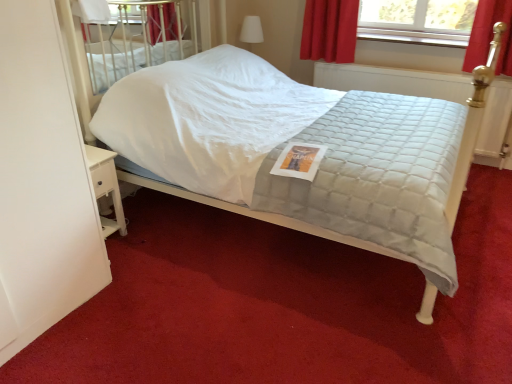
Find the location of a particular element. white matte screen door at left is located at coordinates (42, 182).

In order to click on white matte screen door at left in this screenshot , I will do `click(42, 182)`.

From the image's perspective, relative to white quilted fabric bed at center, is white wood nightstand at lower left above or below?

white wood nightstand at lower left is situated lower than white quilted fabric bed at center in the image.

Is white wood nightstand at lower left facing away from white quilted fabric bed at center?

white wood nightstand at lower left does not have its back to white quilted fabric bed at center.

Considering the relative positions of white wood nightstand at lower left and white quilted fabric bed at center in the image provided, is white wood nightstand at lower left to the left of white quilted fabric bed at center from the viewer's perspective?

Indeed, white wood nightstand at lower left is positioned on the left side of white quilted fabric bed at center.

Between white wood nightstand at lower left and white matte screen door at left, which one appears on the left side from the viewer's perspective?

From the viewer's perspective, white matte screen door at left appears more on the left side.

Considering the relative sizes of white wood nightstand at lower left and white matte screen door at left in the image provided, is white wood nightstand at lower left bigger than white matte screen door at left?

Incorrect, white wood nightstand at lower left is not larger than white matte screen door at left.

Does white wood nightstand at lower left have a greater width compared to white matte screen door at left?

No, white wood nightstand at lower left is not wider than white matte screen door at left.

Which is in front, white wood nightstand at lower left or white matte screen door at left?

white matte screen door at left is in front.

Does white matte screen door at left appear on the left side of white wood nightstand at lower left?

Yes, white matte screen door at left is to the left of white wood nightstand at lower left.

Is white matte screen door at left not within white wood nightstand at lower left?

Yes, white matte screen door at left is located beyond the bounds of white wood nightstand at lower left.

Is white matte screen door at left turned away from white wood nightstand at lower left?

No, white wood nightstand at lower left is not at the back of white matte screen door at left.

Considering the points (57, 240) and (104, 187), which point is in front, point (57, 240) or point (104, 187)?

Point (57, 240)

Who is shorter, white quilted fabric bed at center or white wood nightstand at lower left?

white wood nightstand at lower left.

Is white quilted fabric bed at center turned away from white wood nightstand at lower left?

That's not correct — white quilted fabric bed at center is not looking away from white wood nightstand at lower left.

Is white quilted fabric bed at center situated inside white wood nightstand at lower left or outside?

white quilted fabric bed at center is located beyond the bounds of white wood nightstand at lower left.

Which is more to the right, white quilted fabric bed at center or white wood nightstand at lower left?

white quilted fabric bed at center is more to the right.

Between white quilted fabric bed at center and white matte screen door at left, which one has larger size?

white quilted fabric bed at center is bigger.

Measure the distance between white quilted fabric bed at center and white matte screen door at left.

white quilted fabric bed at center is 3.40 feet away from white matte screen door at left.

Would you say white quilted fabric bed at center is outside white matte screen door at left?

Yes, white quilted fabric bed at center is not within white matte screen door at left.

Who is taller, white quilted fabric bed at center or white matte screen door at left?

Standing taller between the two is white matte screen door at left.

Considering the relative sizes of white matte screen door at left and white quilted fabric bed at center in the image provided, is white matte screen door at left bigger than white quilted fabric bed at center?

Incorrect, white matte screen door at left is not larger than white quilted fabric bed at center.

Could you tell me if white matte screen door at left is turned towards white quilted fabric bed at center?

No, white matte screen door at left does not turn towards white quilted fabric bed at center.

Is white matte screen door at left touching white quilted fabric bed at center?

white matte screen door at left is not next to white quilted fabric bed at center, and they're not touching.

Consider the image. Does white matte screen door at left have a lesser height compared to white quilted fabric bed at center?

No.

This screenshot has height=384, width=512. In order to click on bed located on the right of white wood nightstand at lower left in this screenshot , I will do [280, 143].

Where is `nightstand below the white matte screen door at left (from the image's perspective)`? This screenshot has height=384, width=512. nightstand below the white matte screen door at left (from the image's perspective) is located at coordinates (106, 187).

Considering their positions, is white wood nightstand at lower left positioned further to white matte screen door at left than white quilted fabric bed at center?

Based on the image, white quilted fabric bed at center appears to be further to white matte screen door at left.

When comparing their distances from white wood nightstand at lower left, does white matte screen door at left or white quilted fabric bed at center seem closer?

white matte screen door at left.

Looking at the image, which one is located further to white matte screen door at left, white quilted fabric bed at center or white wood nightstand at lower left?

white quilted fabric bed at center is further to white matte screen door at left.

When comparing their distances from white wood nightstand at lower left, does white quilted fabric bed at center or white matte screen door at left seem closer?

The object closer to white wood nightstand at lower left is white matte screen door at left.

Estimate the real-world distances between objects in this image. Which object is further from white quilted fabric bed at center, white matte screen door at left or white wood nightstand at lower left?

white matte screen door at left is positioned further to the anchor white quilted fabric bed at center.

Which object lies nearer to the anchor point white quilted fabric bed at center, white wood nightstand at lower left or white matte screen door at left?

The object closer to white quilted fabric bed at center is white wood nightstand at lower left.

Locate an element on the screen. nightstand between white matte screen door at left and white quilted fabric bed at center from left to right is located at coordinates (106, 187).